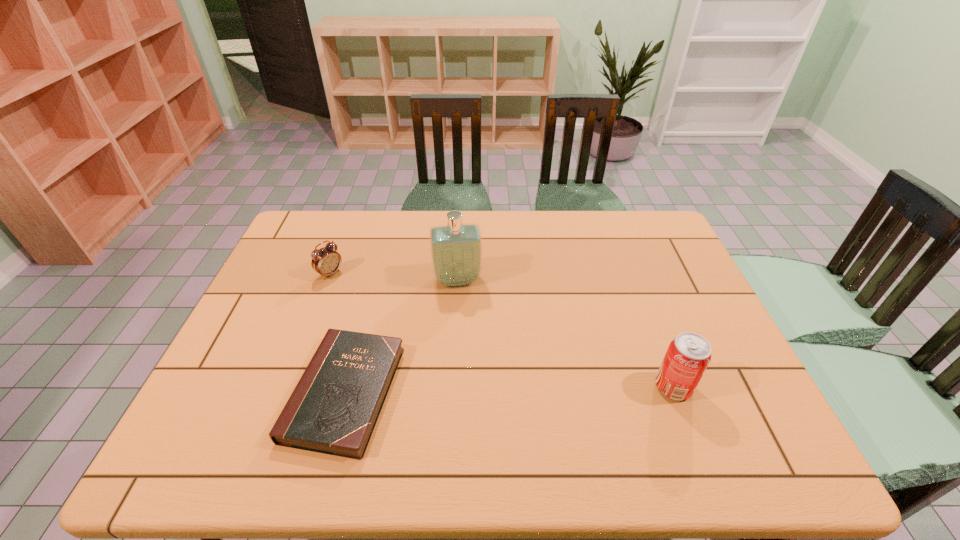
In order to click on vacant point located between the perfume and the shortest object in this screenshot , I will do (x=401, y=336).

At what (x,y) coordinates should I click in order to perform the action: click on free space between the second object from right to left and the rightmost object. Please return your answer as a coordinate pair (x, y). Looking at the image, I should click on (565, 334).

The width and height of the screenshot is (960, 540). In order to click on object that is the second nearest to the Bible in this screenshot , I will do `click(326, 261)`.

Find the location of a particular element. The image size is (960, 540). object that stands as the second closest to the second shortest object is located at coordinates (456, 249).

This screenshot has width=960, height=540. In order to click on free spot that satisfies the following two spatial constraints: 1. on the front side of the alarm clock; 2. on the left side of the Bible in this screenshot , I will do `click(285, 393)`.